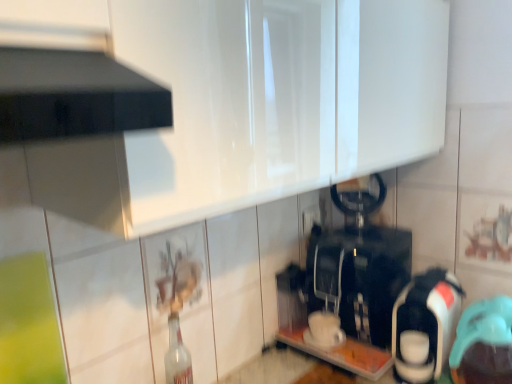
Question: Is black plastic coffee machine at center, arranged as the 3th appliance when viewed from the right, wider or thinner than teal rubber cap at lower right, positioned as the 1th appliance in right-to-left order?

Choices:
 (A) thin
 (B) wide

Answer: (B)

Question: From a real-world perspective, is black plastic coffee machine at center, arranged as the 3th appliance when viewed from the right, above or below teal rubber cap at lower right, positioned as the 1th appliance in right-to-left order?

Choices:
 (A) below
 (B) above

Answer: (B)

Question: Estimate the real-world distances between objects in this image. Which object is farther from the clear glass bottle at center?

Choices:
 (A) black plastic coffee machine at center, arranged as the 3th appliance when viewed from the right
 (B) teal rubber cap at lower right, positioned as the 1th appliance in right-to-left order
 (C) white glossy coffee maker at right, which ranks as the second appliance in left-to-right order

Answer: (B)

Question: Based on their relative distances, which object is farther from the black plastic coffee machine at center, arranged as the 3th appliance when viewed from the right?

Choices:
 (A) teal rubber cap at lower right, which is the 3th appliance in left-to-right order
 (B) clear glass bottle at center
 (C) white glossy coffee maker at right, which ranks as the second appliance in left-to-right order

Answer: (B)